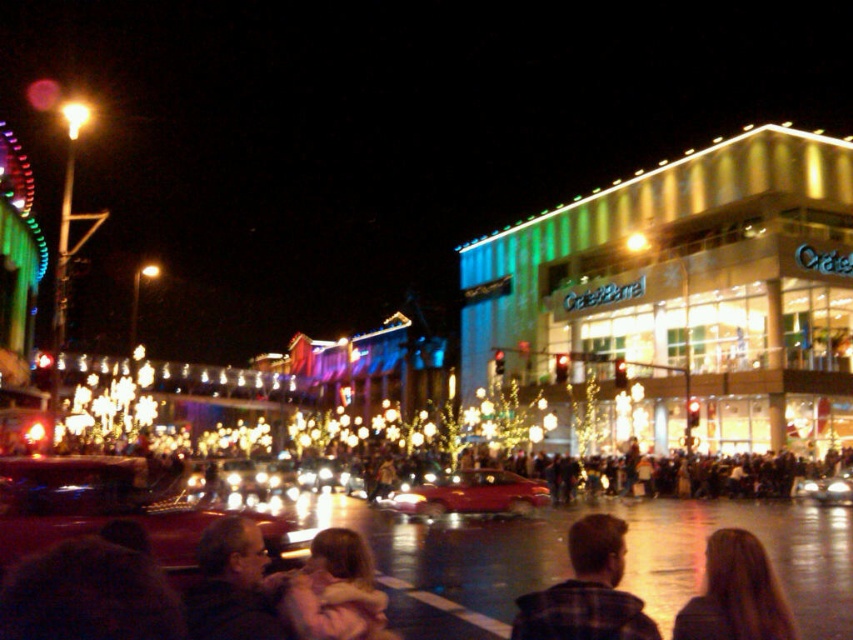
Question: Estimate the real-world distances between objects in this image. Which object is farther from the shiny black car at center?

Choices:
 (A) blonde hair at center
 (B) green glass building at upper right
 (C) shiny silver car at center

Answer: (C)

Question: Which point is closer to the camera taking this photo?

Choices:
 (A) (646, 248)
 (B) (845, 490)

Answer: (B)

Question: Is shiny red car at center to the right of bright yellow light at center from the viewer's perspective?

Choices:
 (A) yes
 (B) no

Answer: (B)

Question: Does long brown hair at lower right appear on the left side of blonde hair at center?

Choices:
 (A) no
 (B) yes

Answer: (A)

Question: Considering the real-world distances, which object is farthest from the shiny red car at center?

Choices:
 (A) shiny black car at center
 (B) bright yellow light at center
 (C) dark brown leather jacket at lower left
 (D) matte yellow streetlight at upper left

Answer: (D)

Question: Is blonde hair at center wider than bright yellow light at center?

Choices:
 (A) no
 (B) yes

Answer: (B)